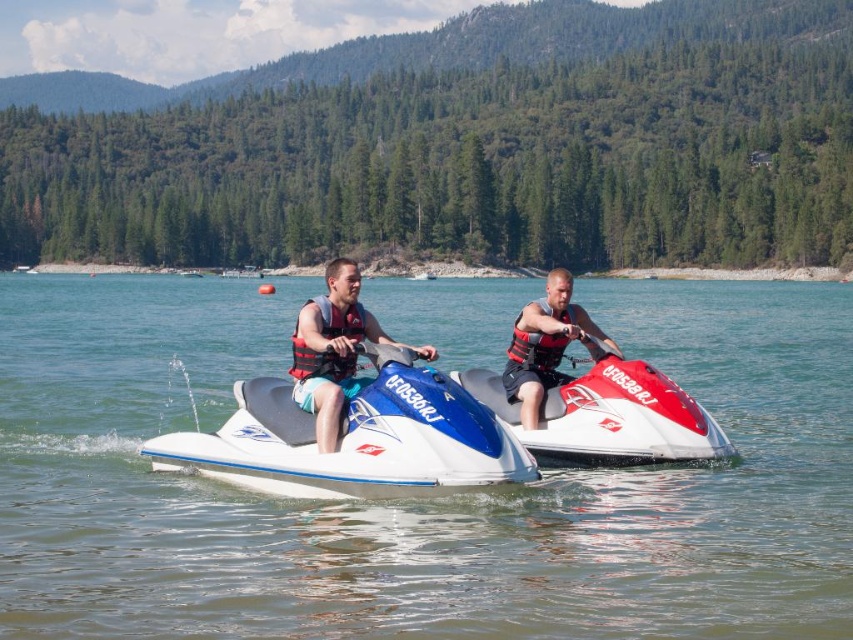
In the scene shown: You are standing on the dock and want to swim to the clear blue water at center. Is the point at coordinates point (416,500) in the direction of the clear blue water at center?

The point (416,500) is on clear blue water at center, so yes, the point is directly on the clear blue water at center. You can swim straight to it.

In the scene shown: You are a safety inspector checking the placement of life vests on a jet ski. You notice the clear blue water at center and the matte red life vest at center. Which object is located to the right of the other?

The clear blue water at center is positioned on the right side of matte red life vest at center.